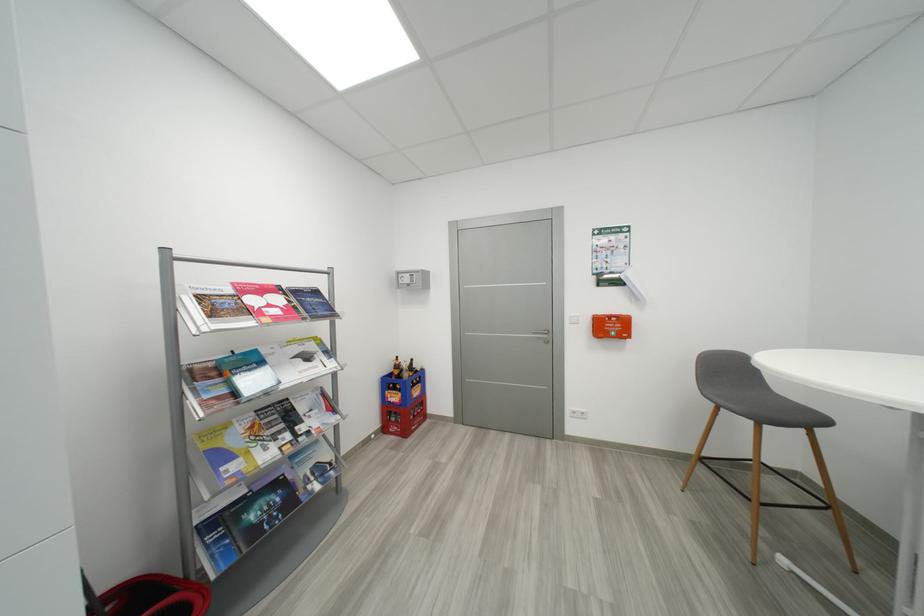
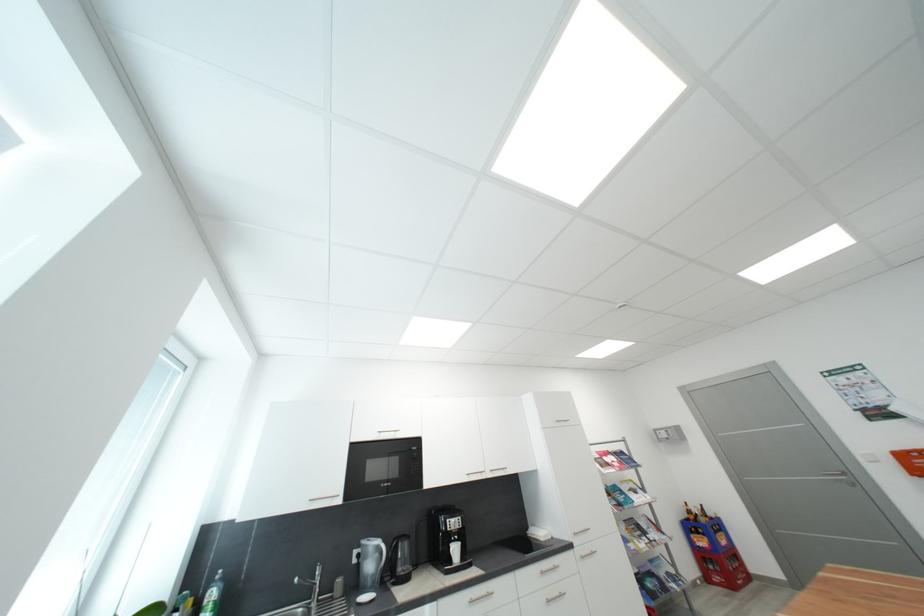
Find the pixel in the second image that matches [412,377] in the first image.

(710, 522)